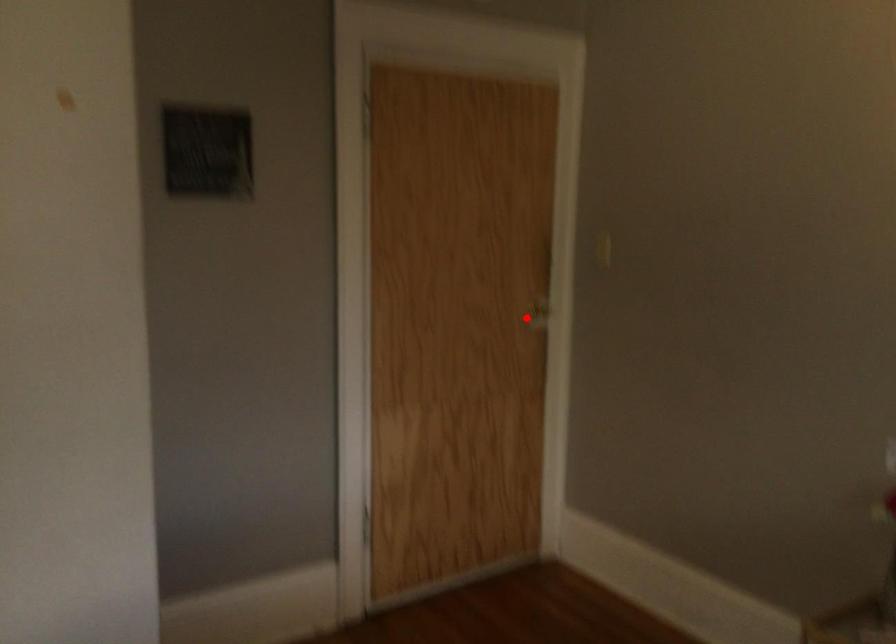
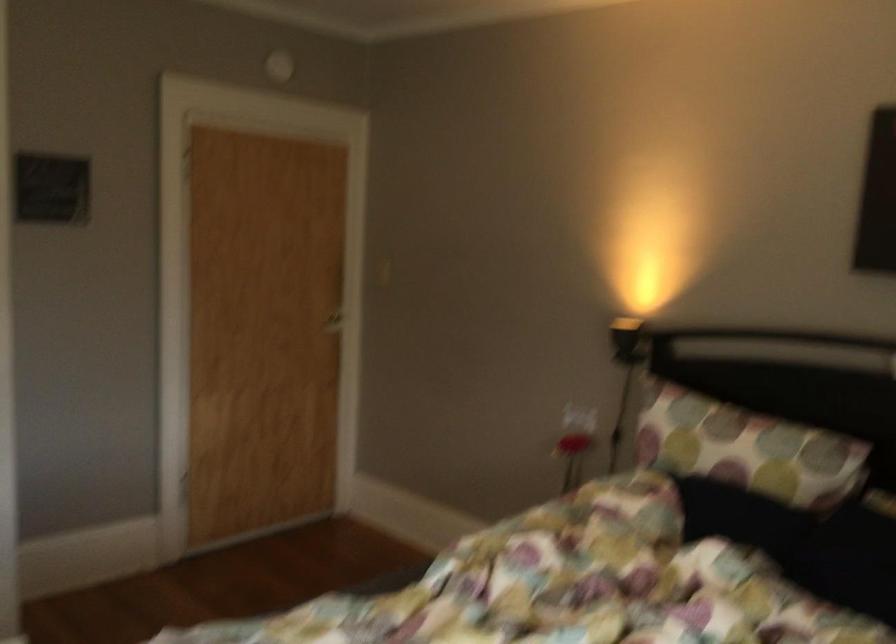
Locate, in the second image, the point that corresponds to the highlighted location in the first image.

(328, 319)